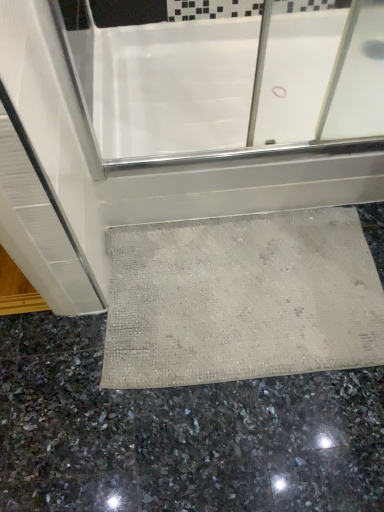
The width and height of the screenshot is (384, 512). Find the location of `blank space above beige textured bath mat at lower center (from a real-world perspective)`. blank space above beige textured bath mat at lower center (from a real-world perspective) is located at coordinates (229, 286).